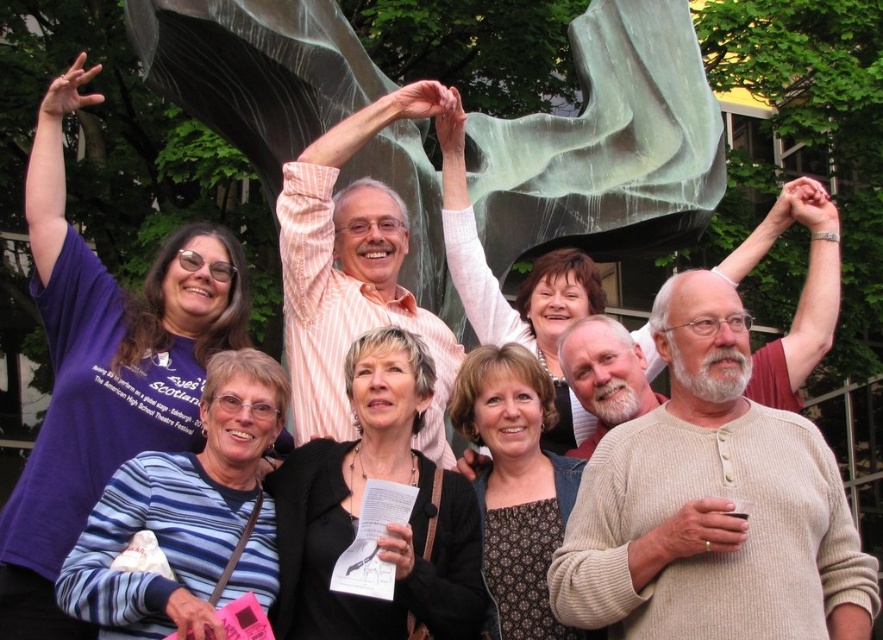
Question: Is purple cotton shirt at upper left below patterned fabric dress at center?

Choices:
 (A) yes
 (B) no

Answer: (B)

Question: Which of the following is the closest to the observer?

Choices:
 (A) matte white blouse at center
 (B) purple cotton shirt at upper left
 (C) black matte jacket at center
 (D) patterned fabric dress at center

Answer: (C)

Question: Does blue striped sweater at lower left have a larger size compared to patterned fabric dress at center?

Choices:
 (A) yes
 (B) no

Answer: (A)

Question: Based on their relative distances, which object is farther from the patterned fabric dress at center?

Choices:
 (A) purple cotton shirt at upper left
 (B) matte white blouse at center
 (C) black matte jacket at center
 (D) blue striped sweater at lower left

Answer: (A)

Question: Estimate the real-world distances between objects in this image. Which object is farther from the purple cotton shirt at upper left?

Choices:
 (A) patterned fabric dress at center
 (B) matte white blouse at center
 (C) blue striped sweater at lower left

Answer: (B)

Question: Does purple cotton shirt at upper left have a greater width compared to blue striped sweater at lower left?

Choices:
 (A) no
 (B) yes

Answer: (B)